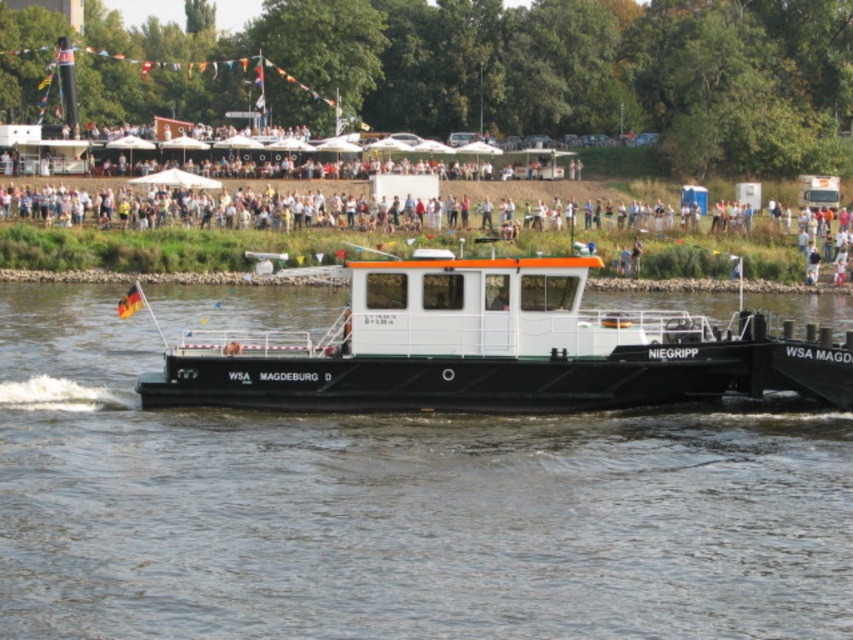
Does black matte barge at center come in front of white matte barge at center?

Yes, black matte barge at center is in front of white matte barge at center.

Between black matte barge at center and white matte barge at center, which one is positioned lower?

Positioned lower is black matte barge at center.

Does point (73, 376) come behind point (480, 368)?

Yes, point (73, 376) is behind point (480, 368).

Find the location of a particular element. This screenshot has height=640, width=853. black matte barge at center is located at coordinates (395, 509).